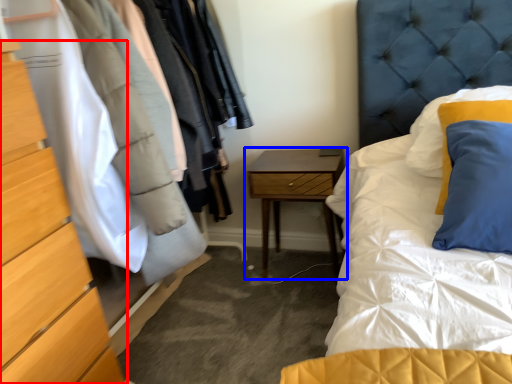
Question: Among these objects, which one is nearest to the camera, chest of drawers (highlighted by a red box) or nightstand (highlighted by a blue box)?

Choices:
 (A) chest of drawers
 (B) nightstand

Answer: (A)